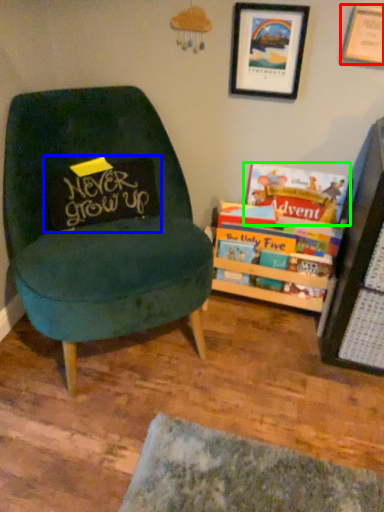
Question: Which is nearer to the picture frame (highlighted by a red box)? pillow (highlighted by a blue box) or book (highlighted by a green box).

Choices:
 (A) pillow
 (B) book

Answer: (B)